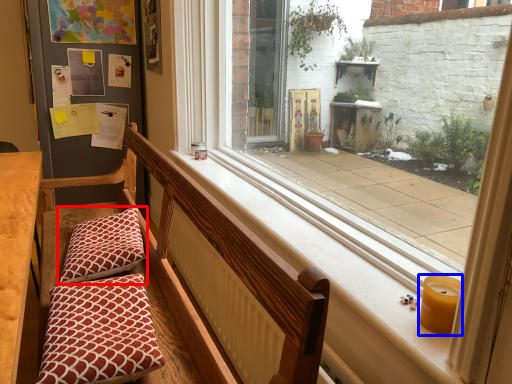
Question: Which object is further to the camera taking this photo, pillow (highlighted by a red box) or candle holder (highlighted by a blue box)?

Choices:
 (A) pillow
 (B) candle holder

Answer: (A)